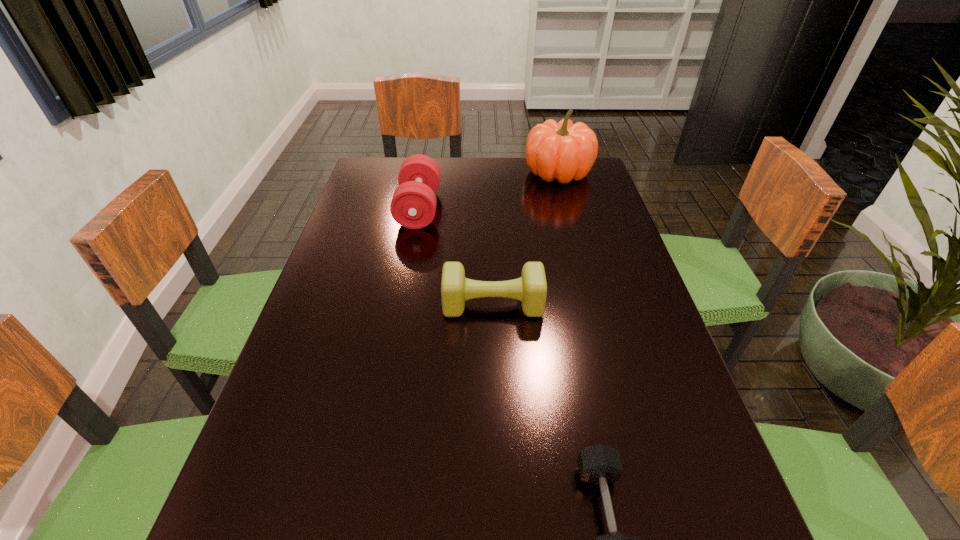
At what (x,y) coordinates should I click in order to perform the action: click on object that is at the left edge. Please return your answer as a coordinate pair (x, y). The width and height of the screenshot is (960, 540). Looking at the image, I should click on (413, 205).

Locate an element on the screen. Image resolution: width=960 pixels, height=540 pixels. object that is at the right edge is located at coordinates click(563, 151).

Identify the location of object at the far left corner. The image size is (960, 540). (413, 205).

At what (x,y) coordinates should I click in order to perform the action: click on object located at the far right corner. Please return your answer as a coordinate pair (x, y). The width and height of the screenshot is (960, 540). Looking at the image, I should click on (563, 151).

In the image, there is a desktop. Identify the location of free space at the far edge. coord(525,190).

In the image, there is a desktop. Where is `free space at the left edge`? free space at the left edge is located at coordinates (314, 459).

Find the location of a particular element. The image size is (960, 540). vacant space at the right edge of the desktop is located at coordinates (657, 354).

Identify the location of vacant space at the far left corner of the desktop. (386, 174).

The image size is (960, 540). Identify the location of free space at the far right corner. (551, 191).

Where is `vacant area between the second dumbbell from right to left and the tallest object`? vacant area between the second dumbbell from right to left and the tallest object is located at coordinates (526, 239).